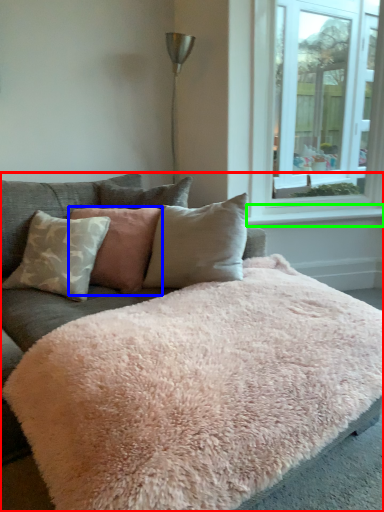
Question: Considering the real-world distances, which object is farthest from studio couch (highlighted by a red box)? pillow (highlighted by a blue box) or window sill (highlighted by a green box)?

Choices:
 (A) pillow
 (B) window sill

Answer: (B)